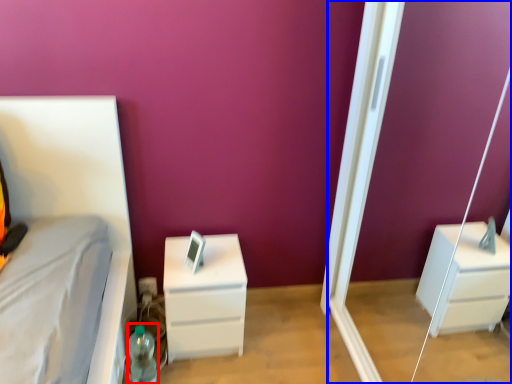
Question: Among these objects, which one is farthest to the camera, bottle (highlighted by a red box) or screen door (highlighted by a blue box)?

Choices:
 (A) bottle
 (B) screen door

Answer: (A)